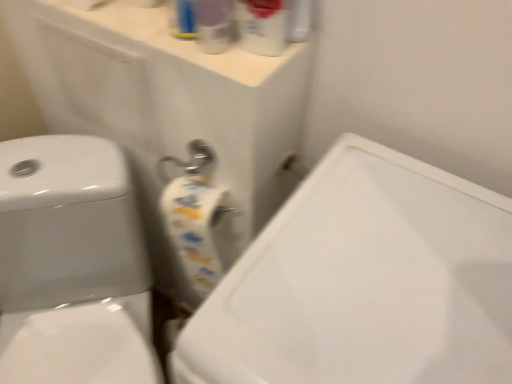
Question: Considering the positions of translucent plastic spray bottle at upper center, which ranks as the 1th cleaning product in left-to-right order, and white glossy toilet at left in the image, is translucent plastic spray bottle at upper center, which ranks as the 1th cleaning product in left-to-right order, wider or thinner than white glossy toilet at left?

Choices:
 (A) thin
 (B) wide

Answer: (A)

Question: Based on their positions, is translucent plastic spray bottle at upper center, which ranks as the 1th cleaning product in left-to-right order, located to the left or right of white glossy toilet at left?

Choices:
 (A) left
 (B) right

Answer: (B)

Question: Estimate the real-world distances between objects in this image. Which object is closer to the translucent plastic spray bottle at upper center, the second cleaning product when ordered from right to left?

Choices:
 (A) white glossy toilet at left
 (B) translucent plastic spray bottle at upper center, which is the second cleaning product from left to right
 (C) white glossy sink at center

Answer: (B)

Question: Which object is the closest to the white glossy sink at center?

Choices:
 (A) translucent plastic spray bottle at upper center, the 1th cleaning product in the right-to-left sequence
 (B) white glossy toilet at left
 (C) translucent plastic spray bottle at upper center, the second cleaning product when ordered from right to left

Answer: (A)